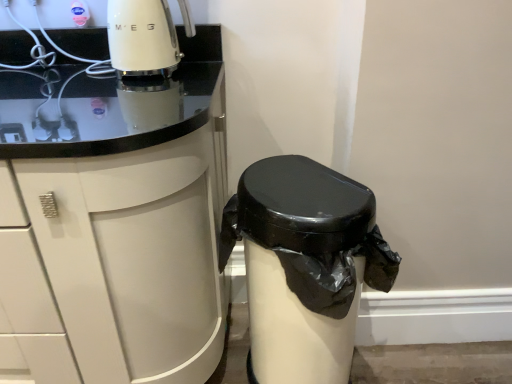
Question: Considering the positions of white glossy cabinet at upper left and black plastic waste bin at lower right in the image, is white glossy cabinet at upper left wider or thinner than black plastic waste bin at lower right?

Choices:
 (A) thin
 (B) wide

Answer: (B)

Question: Considering the positions of point (65, 306) and point (343, 223), is point (65, 306) closer or farther from the camera than point (343, 223)?

Choices:
 (A) closer
 (B) farther

Answer: (B)

Question: From a real-world perspective, is white glossy cabinet at upper left physically located above or below black plastic waste bin at lower right?

Choices:
 (A) below
 (B) above

Answer: (B)

Question: Choose the correct answer: Is black plastic waste bin at lower right inside white glossy cabinet at upper left or outside it?

Choices:
 (A) inside
 (B) outside

Answer: (B)

Question: Is black plastic waste bin at lower right in front of or behind white glossy cabinet at upper left in the image?

Choices:
 (A) behind
 (B) front

Answer: (A)

Question: Based on their sizes in the image, would you say black plastic waste bin at lower right is bigger or smaller than white glossy cabinet at upper left?

Choices:
 (A) small
 (B) big

Answer: (A)

Question: Based on their positions, is black plastic waste bin at lower right located to the left or right of white glossy cabinet at upper left?

Choices:
 (A) right
 (B) left

Answer: (A)